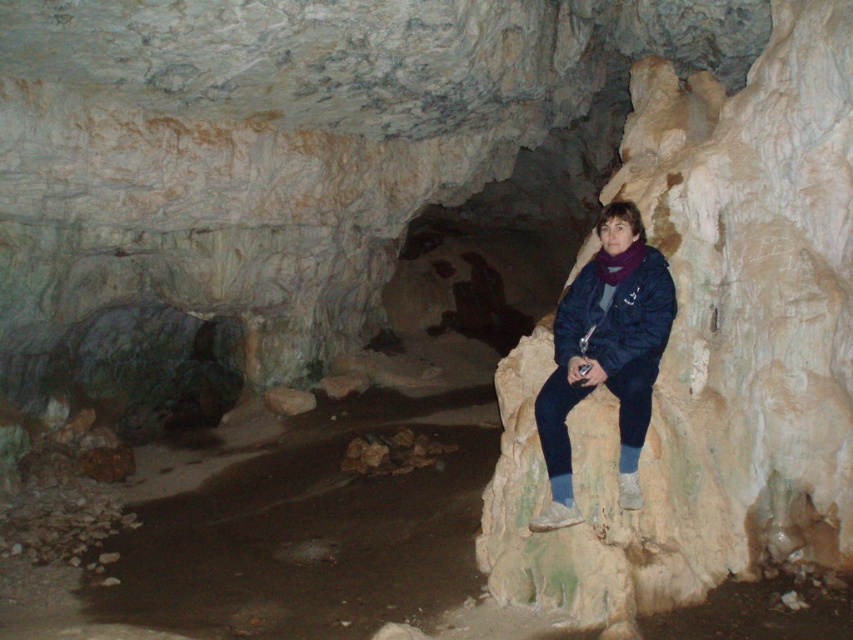
Which is behind, point (728, 420) or point (585, 282)?

Point (585, 282)

Measure the distance between white/rough rock at right and camera.

They are 4.18 meters apart.

At what (x,y) coordinates should I click in order to perform the action: click on white/rough rock at right. Please return your answer as a coordinate pair (x, y). This screenshot has height=640, width=853. Looking at the image, I should click on (709, 346).

Is point (628, 362) in front of point (671, 282)?

That is True.

Does dark blue jacket at center appear under dark blue fleece at center?

Indeed, dark blue jacket at center is positioned under dark blue fleece at center.

Does point (643, 340) come in front of point (592, 332)?

Yes.

Where is `dark blue jacket at center`? The image size is (853, 640). dark blue jacket at center is located at coordinates click(605, 355).

This screenshot has width=853, height=640. What do you see at coordinates (709, 346) in the screenshot?
I see `white/rough rock at right` at bounding box center [709, 346].

In order to click on white/rough rock at right in this screenshot , I will do `click(709, 346)`.